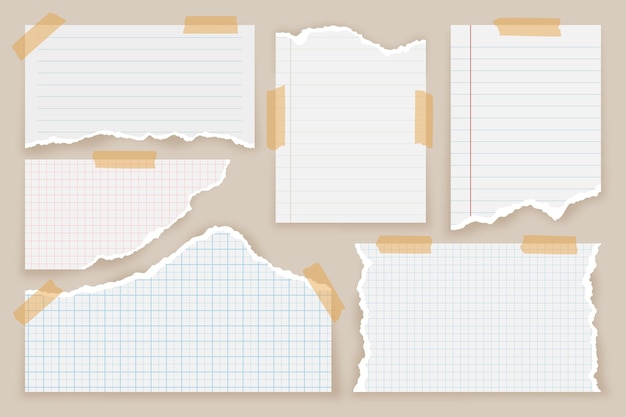
In order to click on pieces of tape in this screenshot , I will do `click(550, 238)`, `click(536, 27)`, `click(422, 114)`, `click(394, 240)`, `click(322, 295)`, `click(275, 108)`, `click(227, 23)`, `click(53, 32)`, `click(130, 155)`, `click(41, 295)`.